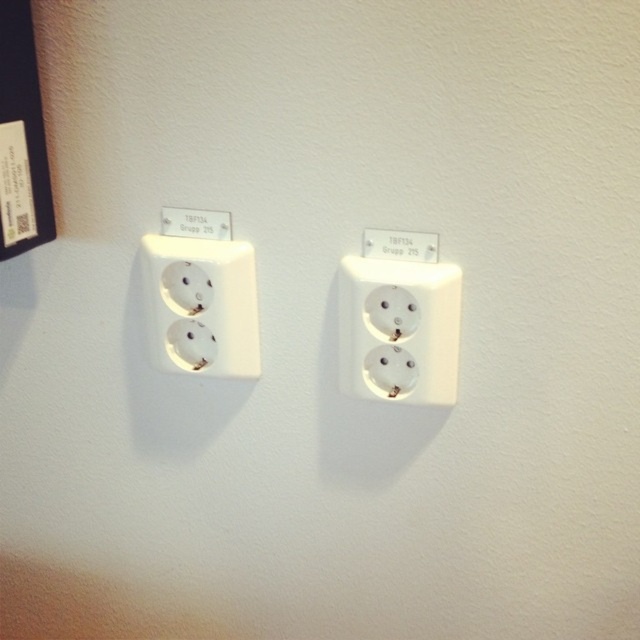
You are an electrician installing a new outlet in a room. You need to place it exactly where the existing white plastic outlet at center is located, which is marked by point (397, 330). However, you realize that the new outlet is slightly larger than the old one. Will the new outlet fit in the same space if the maximum allowable coordinates for placement are 0.52 and 0.63 respectively?

The existing white plastic outlet at center is located at point (397, 330). The maximum allowable coordinates for placement are 0.52 and 0.63. Since 0.516 is less than 0.52 and 0.623 is less than 0.63, the new outlet will fit within the allowed coordinates.